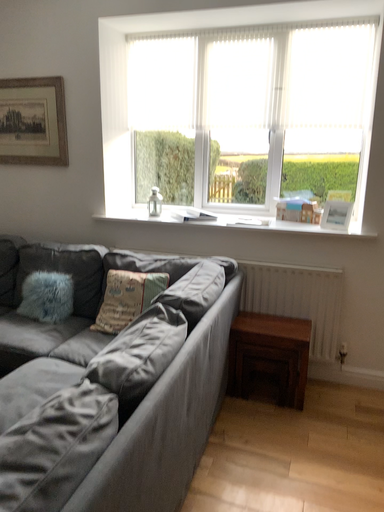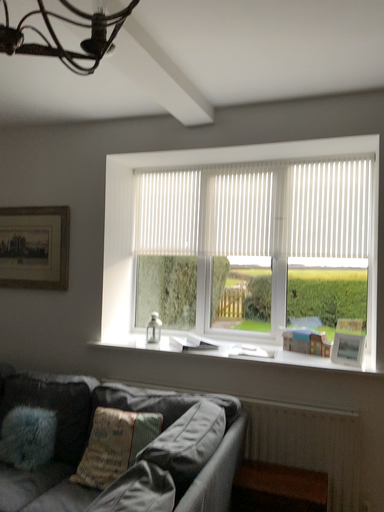
Question: How did the camera likely rotate when shooting the video?

Choices:
 (A) rotated downward
 (B) rotated upward

Answer: (B)